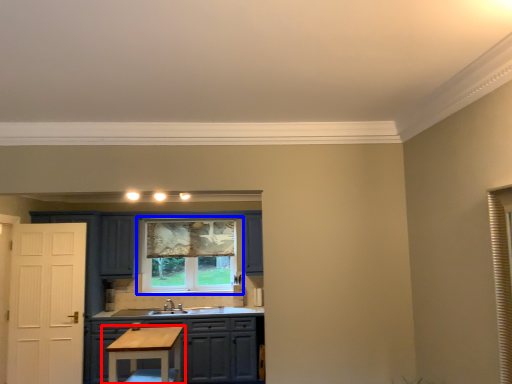
Question: Which point is closer to the camera, table (highlighted by a red box) or window (highlighted by a blue box)?

Choices:
 (A) table
 (B) window

Answer: (A)